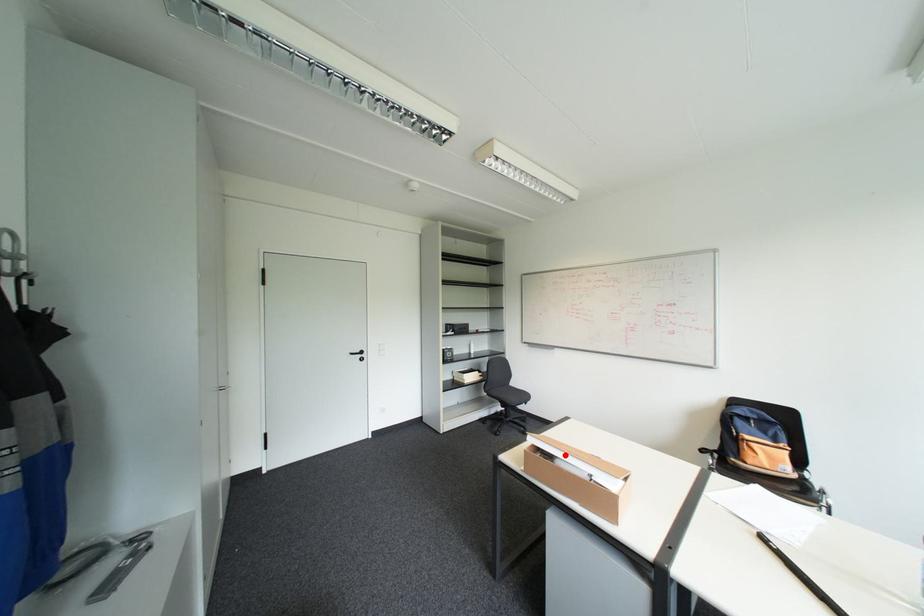
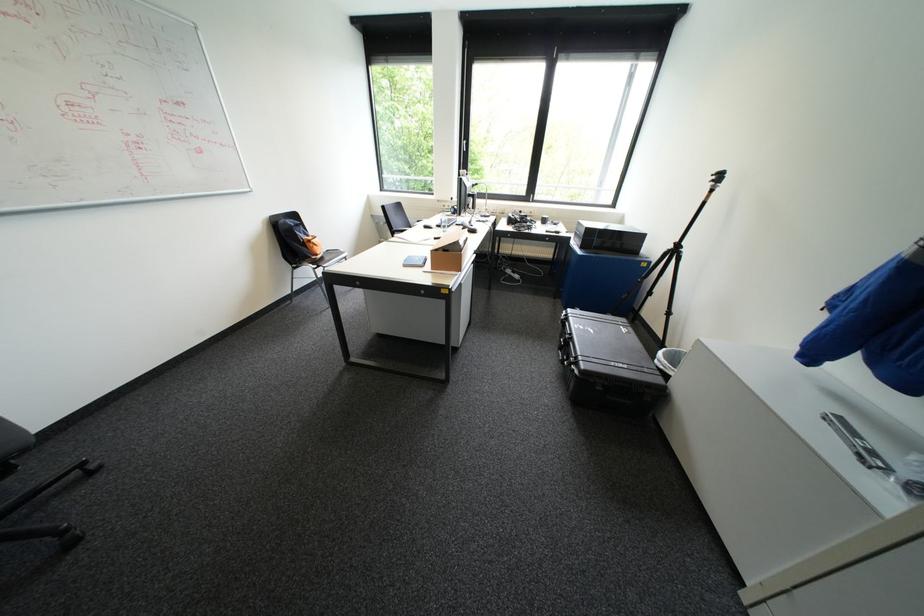
Question: I am providing you with two images of the same scene from different viewpoints. A red point is marked on the first image. Can you still see the location of the red point in image 2?

Choices:
 (A) Yes
 (B) No

Answer: (B)